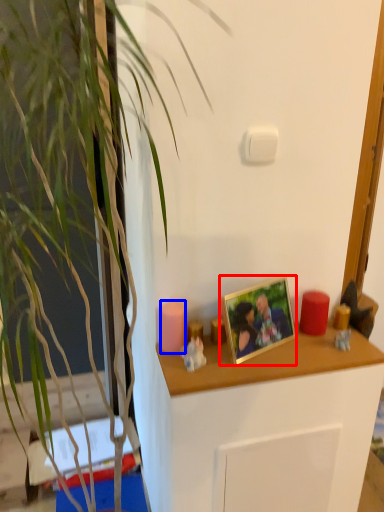
Question: Which point is closer to the camera, picture frame (highlighted by a red box) or candle (highlighted by a blue box)?

Choices:
 (A) picture frame
 (B) candle

Answer: (A)